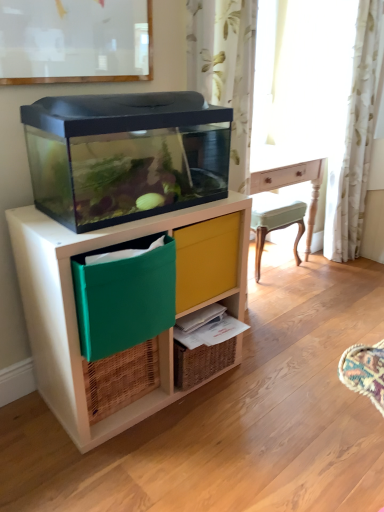
Image resolution: width=384 pixels, height=512 pixels. What do you see at coordinates (120, 379) in the screenshot?
I see `woven brown basket at lower left` at bounding box center [120, 379].

What do you see at coordinates (353, 144) in the screenshot?
I see `white floral fabric curtain at right` at bounding box center [353, 144].

Locate an element on the screen. woven brown basket at lower left is located at coordinates (120, 379).

Considering the relative positions of transparent plastic aquarium at left and green fabric storage box at lower left in the image provided, is transparent plastic aquarium at left to the left of green fabric storage box at lower left from the viewer's perspective?

No, transparent plastic aquarium at left is not to the left of green fabric storage box at lower left.

Considering the relative sizes of transparent plastic aquarium at left and green fabric storage box at lower left in the image provided, is transparent plastic aquarium at left smaller than green fabric storage box at lower left?

Actually, transparent plastic aquarium at left might be larger than green fabric storage box at lower left.

Choose the correct answer: Is transparent plastic aquarium at left inside green fabric storage box at lower left or outside it?

transparent plastic aquarium at left cannot be found inside green fabric storage box at lower left.

Considering the relative sizes of transparent plastic aquarium at left and woven brown basket at lower left in the image provided, is transparent plastic aquarium at left thinner than woven brown basket at lower left?

No.

From the image's perspective, who appears lower, transparent plastic aquarium at left or woven brown basket at lower left?

woven brown basket at lower left, from the image's perspective.

Is transparent plastic aquarium at left positioned behind woven brown basket at lower left?

No, transparent plastic aquarium at left is closer to the camera.

Is point (195, 246) positioned in front of point (146, 357)?

That is True.

Is woven brown basket at lower left located within yellow fabric drawer at center?

No, woven brown basket at lower left is not a part of yellow fabric drawer at center.

Who is shorter, yellow fabric drawer at center or woven brown basket at lower left?

With less height is woven brown basket at lower left.

From the image's perspective, is yellow fabric drawer at center located above or below woven brown basket at lower left?

Clearly, from the image's perspective, yellow fabric drawer at center is above woven brown basket at lower left.

Is woven wood shelf at lower center positioned beyond the bounds of woven brown basket at lower left?

woven wood shelf at lower center lies outside woven brown basket at lower left's area.

Considering the sizes of objects woven wood shelf at lower center and woven brown basket at lower left in the image provided, who is thinner, woven wood shelf at lower center or woven brown basket at lower left?

Thinner between the two is woven brown basket at lower left.

From the image's perspective, between woven wood shelf at lower center and woven brown basket at lower left, which one is located above?

woven wood shelf at lower center.

Is woven wood shelf at lower center taller than woven brown basket at lower left?

No.

Can you confirm if green fabric storage box at lower left is bigger than white floral fabric curtain at right?

No, green fabric storage box at lower left is not bigger than white floral fabric curtain at right.

From a real-world perspective, who is located higher, green fabric storage box at lower left or white floral fabric curtain at right?

white floral fabric curtain at right, from a real-world perspective.

You are a GUI agent. You are given a task and a screenshot of the screen. Output one action in this format:
    pyautogui.click(x=<x>, y=<y>)
    Task: Click on the curtain that is above the green fabric storage box at lower left (from the image's perspective)
    
    Given the screenshot: What is the action you would take?
    pyautogui.click(x=353, y=144)

Between point (156, 298) and point (336, 186), which one is positioned in front?

The point (156, 298) is more forward.

In the image, is woven brown basket at lower left on the left side or the right side of white floral fabric curtain at right?

Clearly, woven brown basket at lower left is on the left of white floral fabric curtain at right in the image.

Who is more distant, woven brown basket at lower left or white floral fabric curtain at right?

white floral fabric curtain at right is more distant.

Could you tell me if woven brown basket at lower left is facing white floral fabric curtain at right?

No, woven brown basket at lower left is not aimed at white floral fabric curtain at right.

From the image's perspective, which object appears higher, woven brown basket at lower left or white floral fabric curtain at right?

From the image's view, white floral fabric curtain at right is above.

Between woven wood shelf at lower center and white floral fabric curtain at right, which one has more height?

white floral fabric curtain at right.

Between woven wood shelf at lower center and white floral fabric curtain at right, which one is positioned in front?

woven wood shelf at lower center.

Consider the image. Which object is wider, woven wood shelf at lower center or white floral fabric curtain at right?

woven wood shelf at lower center is wider.

Can white floral fabric curtain at right be found inside woven wood shelf at lower center?

That's incorrect, white floral fabric curtain at right is not inside woven wood shelf at lower center.

Locate an element on the screen. The width and height of the screenshot is (384, 512). the chest of drawers located underneath the green fabric storage box at lower left (from a real-world perspective) is located at coordinates (74, 300).

Find the location of a particular element. The image size is (384, 512). chest of drawers on the right side of woven brown basket at lower left is located at coordinates (74, 300).

Considering their positions, is white floral fabric curtain at right positioned further to woven brown basket at lower left than green fabric storage box at lower left?

white floral fabric curtain at right is positioned further to the anchor woven brown basket at lower left.

Estimate the real-world distances between objects in this image. Which object is closer to woven wood shelf at lower center, transparent plastic aquarium at left or green fabric storage box at lower left?

transparent plastic aquarium at left lies closer to woven wood shelf at lower center than the other object.

Looking at the image, which one is located closer to green fabric storage box at lower left, woven wood shelf at lower center or woven brown basket at lower left?

woven brown basket at lower left is positioned closer to the anchor green fabric storage box at lower left.

Looking at the image, which one is located closer to transparent plastic aquarium at left, woven brown basket at lower left or green fabric storage box at lower left?

green fabric storage box at lower left is positioned closer to the anchor transparent plastic aquarium at left.

From the image, which object appears to be farther from woven brown basket at lower left, transparent plastic aquarium at left or green fabric storage box at lower left?

green fabric storage box at lower left lies further to woven brown basket at lower left than the other object.

Considering their positions, is green fabric storage box at lower left positioned closer to transparent plastic aquarium at left than yellow fabric drawer at center?

Among the two, green fabric storage box at lower left is located nearer to transparent plastic aquarium at left.

Considering their positions, is woven brown basket at lower left positioned closer to white floral fabric curtain at right than woven wood shelf at lower center?

Among the two, woven wood shelf at lower center is located nearer to white floral fabric curtain at right.

From the image, which object appears to be nearer to yellow fabric drawer at center, woven brown basket at lower left or woven wood shelf at lower center?

Among the two, woven wood shelf at lower center is located nearer to yellow fabric drawer at center.

Find the location of a particular element. shelf between green fabric storage box at lower left and white floral fabric curtain at right is located at coordinates (200, 362).

Where is `drawer between transparent plastic aquarium at left and woven wood shelf at lower center from front to back`? The height and width of the screenshot is (512, 384). drawer between transparent plastic aquarium at left and woven wood shelf at lower center from front to back is located at coordinates (206, 259).

Find the location of a particular element. The width and height of the screenshot is (384, 512). basket between transparent plastic aquarium at left and woven wood shelf at lower center in the front-back direction is located at coordinates (120, 379).

Where is `the chest of drawers positioned between green fabric storage box at lower left and woven wood shelf at lower center from near to far`? Image resolution: width=384 pixels, height=512 pixels. the chest of drawers positioned between green fabric storage box at lower left and woven wood shelf at lower center from near to far is located at coordinates (74, 300).